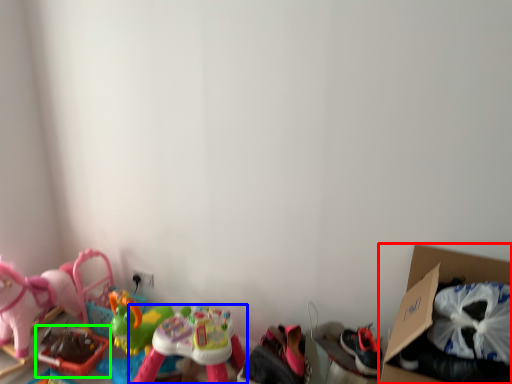
Question: Which object is positioned farthest from cardboard box (highlighted by a red box)? Select from toy (highlighted by a blue box) and toy (highlighted by a green box).

Choices:
 (A) toy
 (B) toy

Answer: (B)